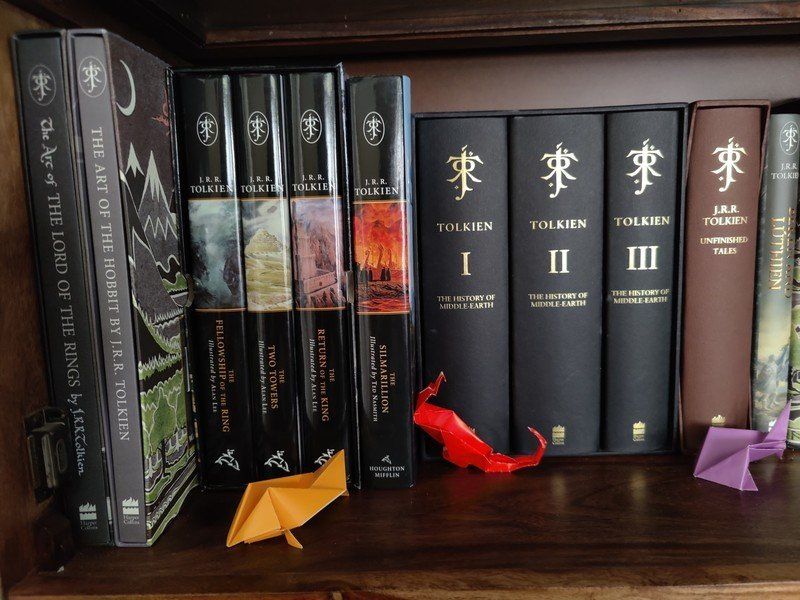
Where is `left side shelf wall`? left side shelf wall is located at coordinates (20, 339), (6, 264), (5, 131).